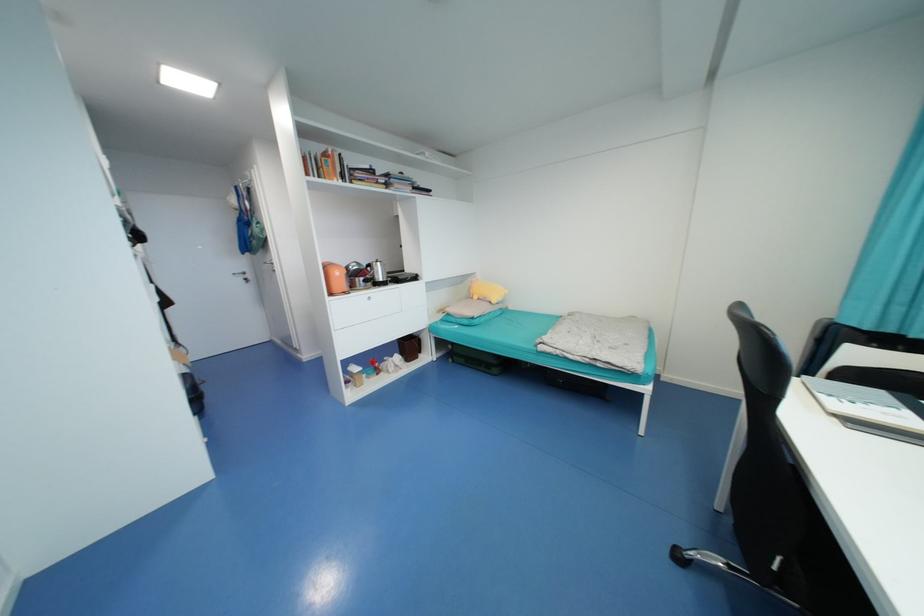
The width and height of the screenshot is (924, 616). What are the coordinates of `yellow stuffed toy` in the screenshot? It's located at (485, 291).